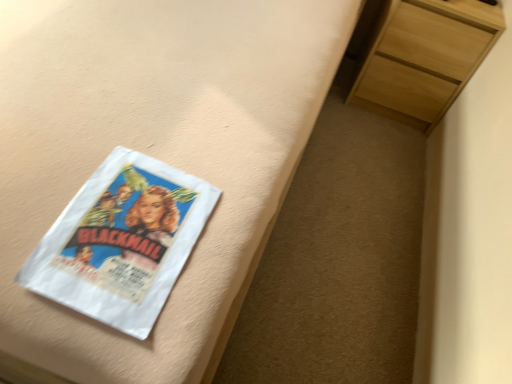
Question: Could you tell me if light wood chest of drawers at upper right is turned towards white paper at left?

Choices:
 (A) no
 (B) yes

Answer: (B)

Question: From the image's perspective, is light wood chest of drawers at upper right on top of white paper at left?

Choices:
 (A) no
 (B) yes

Answer: (B)

Question: Is light wood chest of drawers at upper right to the right of white paper at left from the viewer's perspective?

Choices:
 (A) no
 (B) yes

Answer: (B)

Question: Can you confirm if light wood chest of drawers at upper right is smaller than white paper at left?

Choices:
 (A) yes
 (B) no

Answer: (B)

Question: Considering the relative positions of light wood chest of drawers at upper right and white paper at left in the image provided, is light wood chest of drawers at upper right to the left of white paper at left from the viewer's perspective?

Choices:
 (A) no
 (B) yes

Answer: (A)

Question: Considering their positions, is white paper at left located in front of or behind light wood chest of drawers at upper right?

Choices:
 (A) behind
 (B) front

Answer: (B)

Question: From a real-world perspective, is white paper at left positioned above or below light wood chest of drawers at upper right?

Choices:
 (A) below
 (B) above

Answer: (B)

Question: Which is correct: white paper at left is inside light wood chest of drawers at upper right, or outside of it?

Choices:
 (A) outside
 (B) inside

Answer: (A)

Question: Considering the positions of white paper at left and light wood chest of drawers at upper right in the image, is white paper at left bigger or smaller than light wood chest of drawers at upper right?

Choices:
 (A) big
 (B) small

Answer: (B)

Question: From a real-world perspective, relative to white paper at left, is matte white bed frame at upper left vertically above or below?

Choices:
 (A) below
 (B) above

Answer: (A)

Question: Choose the correct answer: Is matte white bed frame at upper left inside white paper at left or outside it?

Choices:
 (A) outside
 (B) inside

Answer: (A)

Question: From their relative heights in the image, would you say matte white bed frame at upper left is taller or shorter than white paper at left?

Choices:
 (A) tall
 (B) short

Answer: (A)

Question: Is point (84, 91) positioned closer to the camera than point (126, 155)?

Choices:
 (A) closer
 (B) farther

Answer: (B)

Question: Is matte white bed frame at upper left situated inside light wood chest of drawers at upper right or outside?

Choices:
 (A) outside
 (B) inside

Answer: (A)

Question: From the image's perspective, is matte white bed frame at upper left located above or below light wood chest of drawers at upper right?

Choices:
 (A) below
 (B) above

Answer: (A)